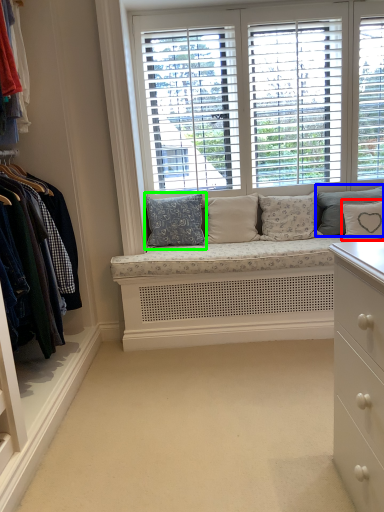
Question: Which is farther away from pillow (highlighted by a red box)? pillow (highlighted by a blue box) or pillow (highlighted by a green box)?

Choices:
 (A) pillow
 (B) pillow

Answer: (B)